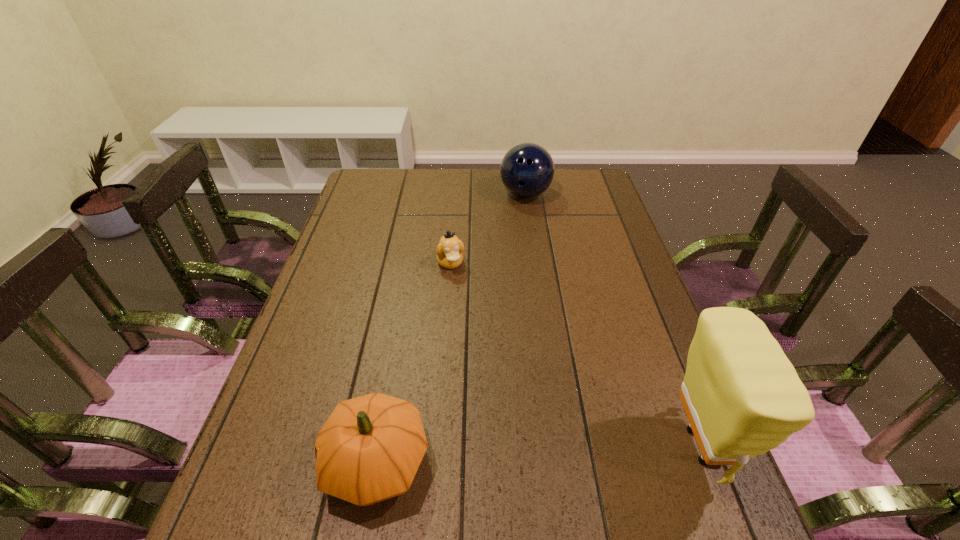
Find the location of a particular element. Image resolution: width=960 pixels, height=540 pixels. free spot on the desktop that is between the gourd and the rightmost object and is positioned on the face of the third nearest object is located at coordinates (525, 455).

Locate an element on the screen. vacant space on the desktop that is between the gourd and the rightmost object and is positioned on the surface of the bowling ball near the finger holes is located at coordinates (579, 452).